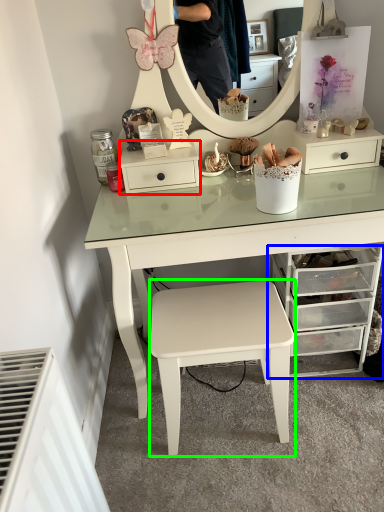
Question: Estimate the real-world distances between objects in this image. Which object is farther from nightstand (highlighted by a red box), chest of drawers (highlighted by a blue box) or stool (highlighted by a green box)?

Choices:
 (A) chest of drawers
 (B) stool

Answer: (A)